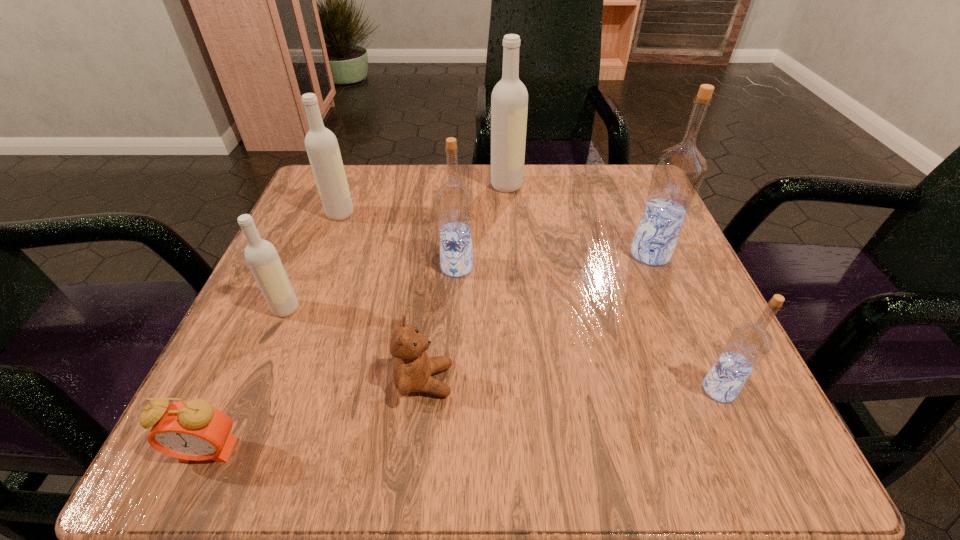
Find the location of a particular element. The height and width of the screenshot is (540, 960). blank space at the left edge of the desktop is located at coordinates (299, 293).

Locate an element on the screen. The image size is (960, 540). vacant area at the right edge is located at coordinates (687, 322).

Locate an element on the screen. vacant area at the far right corner is located at coordinates (597, 201).

The height and width of the screenshot is (540, 960). In order to click on vacant area at the near right corner in this screenshot , I will do `click(748, 465)`.

Identify the location of free area in between the second farthest vodka and the fifth farthest vodka. The width and height of the screenshot is (960, 540). (313, 261).

The image size is (960, 540). I want to click on vacant area that lies between the smallest white vodka and the biggest blue vodka, so click(468, 281).

Identify the location of vacant space in between the second nearest white vodka and the biggest blue vodka. (495, 234).

The image size is (960, 540). Identify the location of unoccupied position between the brown teddy bear and the smallest white vodka. (355, 345).

Where is `free space that is in between the farthest vodka and the alarm clock`? Image resolution: width=960 pixels, height=540 pixels. free space that is in between the farthest vodka and the alarm clock is located at coordinates (357, 318).

I want to click on free space between the third object from right to left and the nearest blue vodka, so click(612, 287).